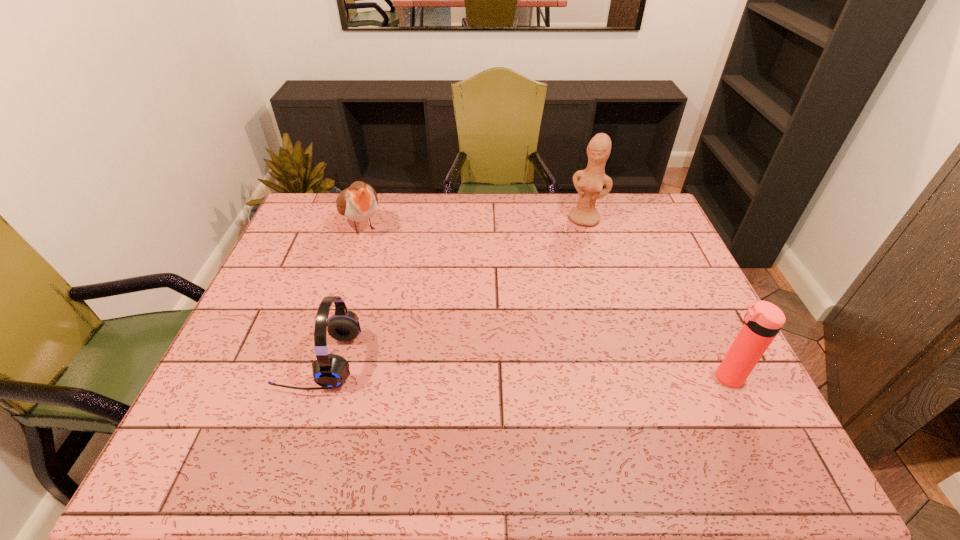
The image size is (960, 540). I want to click on vacant area situated on the front-facing side of the second object from right to left, so click(544, 304).

I want to click on free space located 0.300m on the front-facing side of the second object from right to left, so click(x=554, y=284).

At what (x,y) coordinates should I click in order to perform the action: click on free spot located 0.370m on the front-facing side of the second object from right to left. Please return your answer as a coordinate pair (x, y). The width and height of the screenshot is (960, 540). Looking at the image, I should click on (546, 299).

Identify the location of vacant region located at the face of the bird. (395, 279).

You are a GUI agent. You are given a task and a screenshot of the screen. Output one action in this format:
    pyautogui.click(x=<x>, y=<y>)
    Task: Click on the blank area located 0.340m at the face of the bird
    This screenshot has width=960, height=540.
    Given the screenshot: What is the action you would take?
    pyautogui.click(x=413, y=306)

At what (x,y) coordinates should I click in order to perform the action: click on vacant space located 0.280m at the face of the bird. Please return your answer as a coordinate pair (x, y). The image size is (960, 540). Looking at the image, I should click on (404, 293).

I want to click on figurine present at the far edge, so click(589, 183).

The height and width of the screenshot is (540, 960). What are the coordinates of `bird positioned at the far edge` in the screenshot? It's located at (358, 203).

Identify the location of headset present at the near edge. (330, 371).

The image size is (960, 540). What are the coordinates of `thermos bottle that is positioned at the near edge` in the screenshot? It's located at (763, 320).